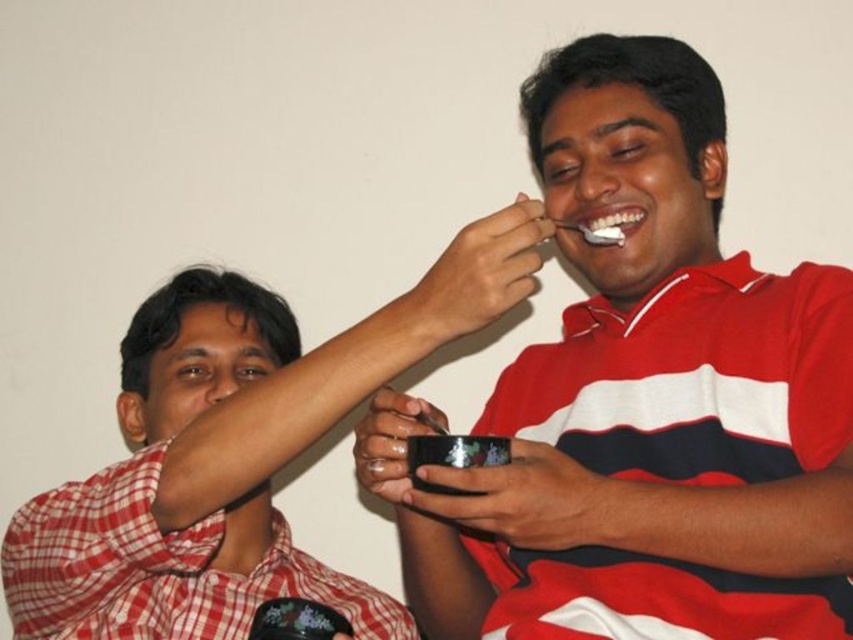
Question: Is matte black bowl at center bigger than matte black bowl at upper center?

Choices:
 (A) yes
 (B) no

Answer: (A)

Question: Which of the following is the closest to the observer?

Choices:
 (A) white glossy teeth at upper center
 (B) matte black bowl at center

Answer: (B)

Question: Is matte black bowl at center positioned before white glossy teeth at upper center?

Choices:
 (A) no
 (B) yes

Answer: (B)

Question: Can you confirm if matte black bowl at center is positioned to the right of white glossy teeth at upper center?

Choices:
 (A) yes
 (B) no

Answer: (A)

Question: Which is farther from the matte black bowl at upper center?

Choices:
 (A) matte black bowl at center
 (B) white glossy teeth at upper center

Answer: (B)

Question: Among these objects, which one is farthest from the camera?

Choices:
 (A) matte black bowl at upper center
 (B) white glossy teeth at upper center
 (C) matte black bowl at center

Answer: (B)